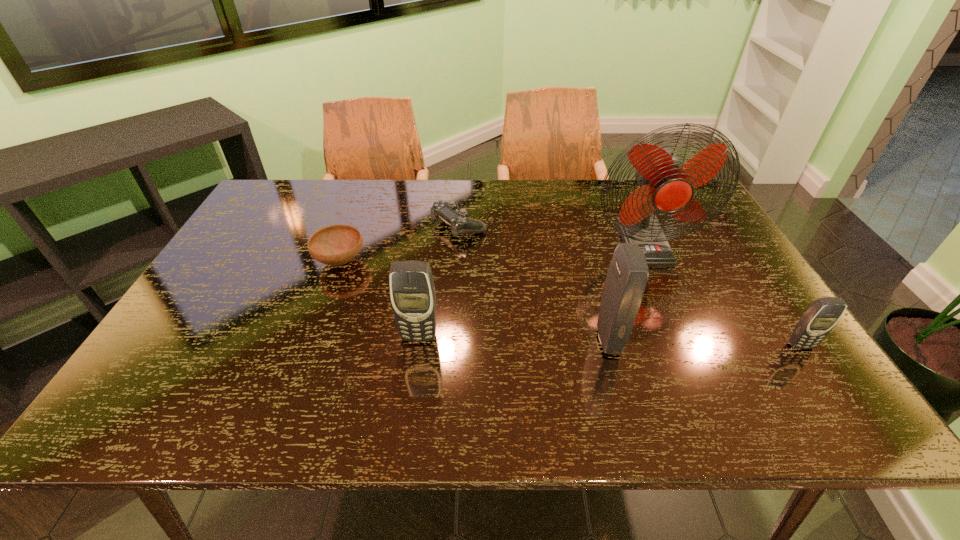
This screenshot has height=540, width=960. Find the location of `object that stands as the third closest to the second shortest cellular telephone`. object that stands as the third closest to the second shortest cellular telephone is located at coordinates (626, 279).

Locate an element on the screen. The width and height of the screenshot is (960, 540). object that is the fifth closest one to the control is located at coordinates (819, 319).

Where is `the second closest cellular telephone relative to the rightmost cellular telephone`? The image size is (960, 540). the second closest cellular telephone relative to the rightmost cellular telephone is located at coordinates (412, 291).

Select which cellular telephone is the second closest to the third tallest object. Please provide its 2D coordinates. Your answer should be formatted as a tuple, i.e. [(x, y)], where the tuple contains the x and y coordinates of a point satisfying the conditions above.

[(819, 319)]

Find the location of `blank area in the image that satisfies the following two spatial constraints: 1. on the front-facing side of the tallest object; 2. on the front face of the second cellular telephone from left to right`. blank area in the image that satisfies the following two spatial constraints: 1. on the front-facing side of the tallest object; 2. on the front face of the second cellular telephone from left to right is located at coordinates (687, 341).

At what (x,y) coordinates should I click in order to perform the action: click on free location that satisfies the following two spatial constraints: 1. on the front-facing side of the tallest object; 2. on the front face of the second cellular telephone from left to right. Please return your answer as a coordinate pair (x, y). The width and height of the screenshot is (960, 540). Looking at the image, I should click on (687, 341).